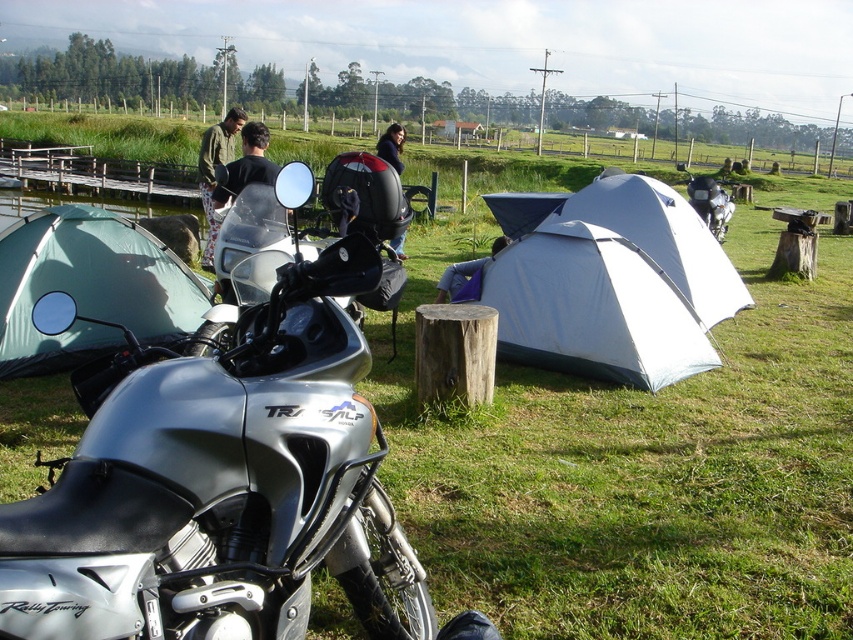
Question: Which point appears farthest from the camera in this image?

Choices:
 (A) (351, 259)
 (B) (21, 284)
 (C) (705, 177)

Answer: (C)

Question: Which of the following is the closest to the observer?

Choices:
 (A) dark blue fabric jacket at center
 (B) blue fabric bag at center
 (C) silver metallic motorcycle at center
 (D) green fabric pants at center

Answer: (C)

Question: Can you confirm if green fabric tent at left is positioned below green fabric pants at center?

Choices:
 (A) no
 (B) yes

Answer: (B)

Question: Estimate the real-world distances between objects in this image. Which object is farther from the white fabric tent at center?

Choices:
 (A) silver metallic motorcycle at center
 (B) green fabric pants at center
 (C) dark green fabric pants at center

Answer: (A)

Question: Does green fabric tent at left have a smaller size compared to metallic silver motorcycle at center?

Choices:
 (A) no
 (B) yes

Answer: (B)

Question: Can you confirm if metallic silver motorcycle at center is positioned above blue fabric bag at center?

Choices:
 (A) yes
 (B) no

Answer: (A)